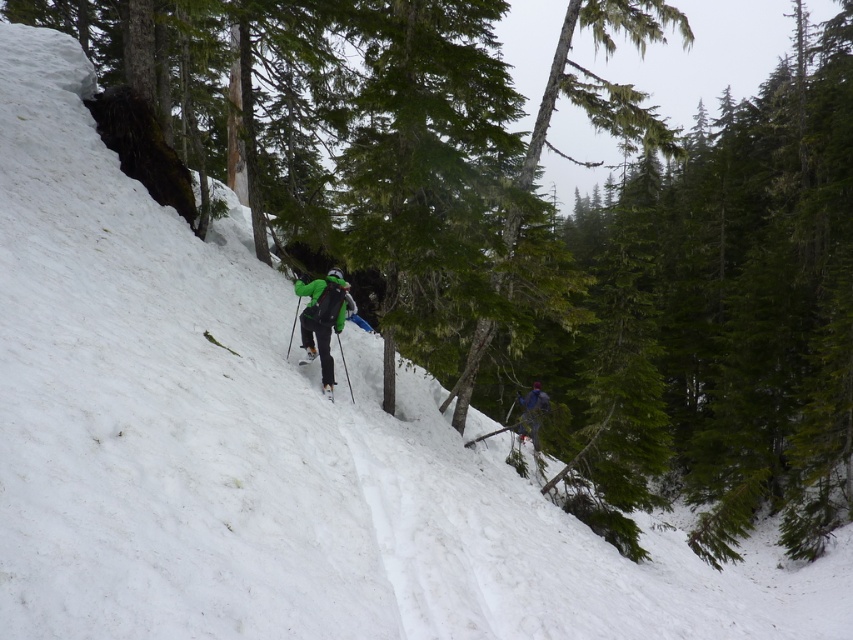
Is blue fabric jacket at center positioned in front of green matte ski at center?

No, it is not.

Who is taller, blue fabric jacket at center or green matte ski at center?

blue fabric jacket at center

Find the location of a particular element. The height and width of the screenshot is (640, 853). blue fabric jacket at center is located at coordinates (532, 413).

Is green matte jacket at center shorter than blue fabric jacket at center?

No.

Can you confirm if green matte jacket at center is positioned above blue fabric jacket at center?

Indeed, green matte jacket at center is positioned over blue fabric jacket at center.

Is point (322, 381) more distant than point (517, 429)?

No, it is not.

Where is `green matte jacket at center`? This screenshot has height=640, width=853. green matte jacket at center is located at coordinates (322, 320).

Does green matte jacket at center appear over green matte ski at center?

Yes, green matte jacket at center is above green matte ski at center.

Is green matte jacket at center smaller than green matte ski at center?

No.

Find the location of a particular element. green matte jacket at center is located at coordinates (322, 320).

I want to click on green matte jacket at center, so click(x=322, y=320).